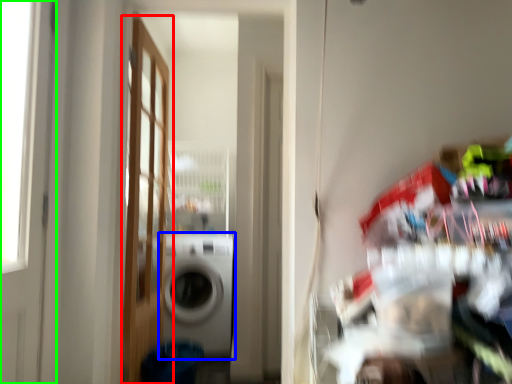
Question: Considering the real-world distances, which object is farthest from door (highlighted by a red box)? washing machine (highlighted by a blue box) or door (highlighted by a green box)?

Choices:
 (A) washing machine
 (B) door

Answer: (B)